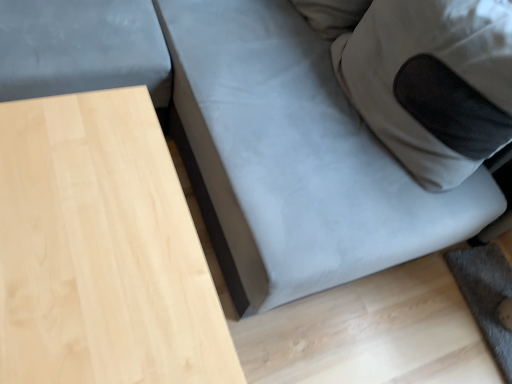
Locate an element on the screen. This screenshot has width=512, height=384. natural wood table at left is located at coordinates (101, 250).

What do you see at coordinates (101, 250) in the screenshot? The height and width of the screenshot is (384, 512). I see `natural wood table at left` at bounding box center [101, 250].

Locate an element on the screen. This screenshot has width=512, height=384. natural wood table at left is located at coordinates (101, 250).